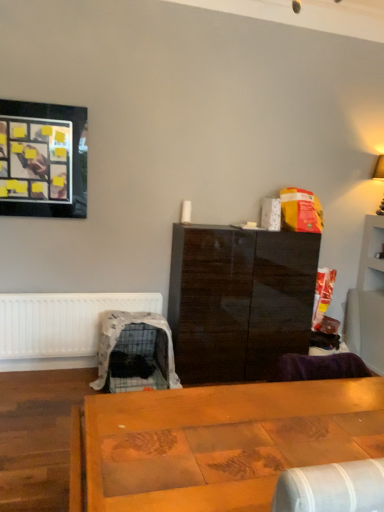
Question: From the image's perspective, is wooden table at center on black glossy picture frame at upper left?

Choices:
 (A) yes
 (B) no

Answer: (B)

Question: Does wooden table at center have a larger size compared to black glossy picture frame at upper left?

Choices:
 (A) yes
 (B) no

Answer: (A)

Question: Is wooden table at center shorter than black glossy picture frame at upper left?

Choices:
 (A) yes
 (B) no

Answer: (A)

Question: Is wooden table at center outside black glossy picture frame at upper left?

Choices:
 (A) yes
 (B) no

Answer: (A)

Question: Can you confirm if wooden table at center is smaller than black glossy picture frame at upper left?

Choices:
 (A) no
 (B) yes

Answer: (A)

Question: Can you confirm if wooden table at center is thinner than black glossy picture frame at upper left?

Choices:
 (A) no
 (B) yes

Answer: (A)

Question: Can you confirm if white matte radiator at lower left is positioned to the left of wooden table at center?

Choices:
 (A) yes
 (B) no

Answer: (A)

Question: Is white matte radiator at lower left positioned beyond the bounds of wooden table at center?

Choices:
 (A) yes
 (B) no

Answer: (A)

Question: Is white matte radiator at lower left taller than wooden table at center?

Choices:
 (A) no
 (B) yes

Answer: (A)

Question: From a real-world perspective, is white matte radiator at lower left positioned under wooden table at center based on gravity?

Choices:
 (A) no
 (B) yes

Answer: (B)

Question: Does white matte radiator at lower left have a lesser height compared to wooden table at center?

Choices:
 (A) yes
 (B) no

Answer: (A)

Question: From the image's perspective, is white matte radiator at lower left over wooden table at center?

Choices:
 (A) yes
 (B) no

Answer: (A)

Question: Does black glossy picture frame at upper left have a smaller size compared to white matte radiator at lower left?

Choices:
 (A) yes
 (B) no

Answer: (A)